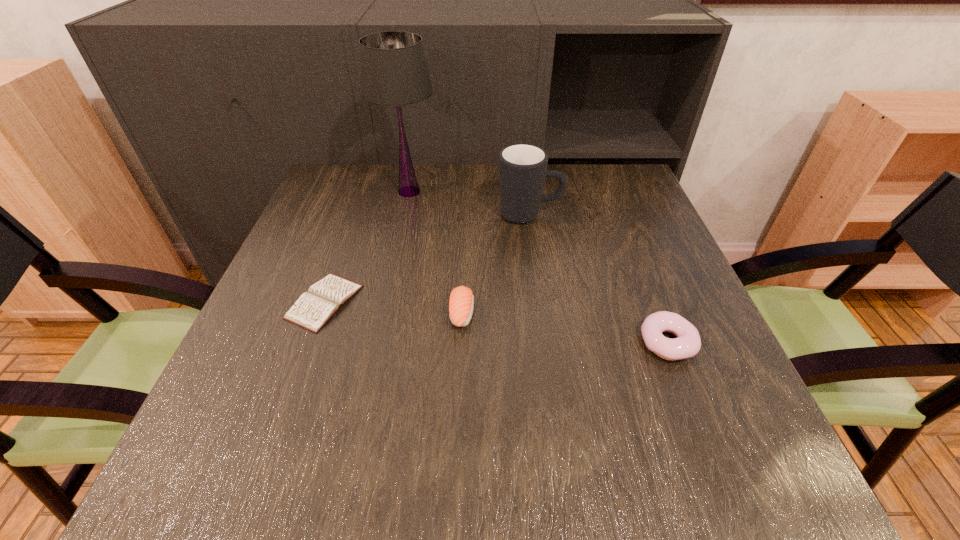
Find the location of a particular element. free space at the right edge of the desktop is located at coordinates (651, 243).

Find the location of a particular element. The image size is (960, 540). vacant space at the far left corner is located at coordinates (341, 165).

Identify the location of free space at the far right corner. The image size is (960, 540). (619, 175).

Locate an element on the screen. vacant area that lies between the mug and the sushi is located at coordinates (495, 264).

Find the location of a particular element. Image resolution: width=960 pixels, height=540 pixels. unoccupied position between the fourth object from left to right and the rightmost object is located at coordinates pyautogui.click(x=599, y=279).

Where is `free space between the third object from left to right and the rightmost object`? This screenshot has height=540, width=960. free space between the third object from left to right and the rightmost object is located at coordinates (565, 328).

Locate an element on the screen. vacant space that's between the lampshade and the diary is located at coordinates (367, 247).

Locate an element on the screen. empty location between the doughnut and the sushi is located at coordinates pos(565,328).

Find the location of a particular element. The height and width of the screenshot is (540, 960). vacant space that is in between the tallest object and the sushi is located at coordinates (436, 252).

Where is `unoccupied area between the tallest object and the rightmost object`? This screenshot has height=540, width=960. unoccupied area between the tallest object and the rightmost object is located at coordinates (539, 267).